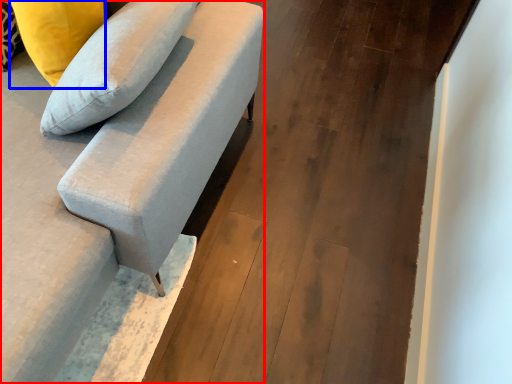
Question: Which of the following is the farthest to the observer, studio couch (highlighted by a red box) or pillow (highlighted by a blue box)?

Choices:
 (A) studio couch
 (B) pillow

Answer: (B)